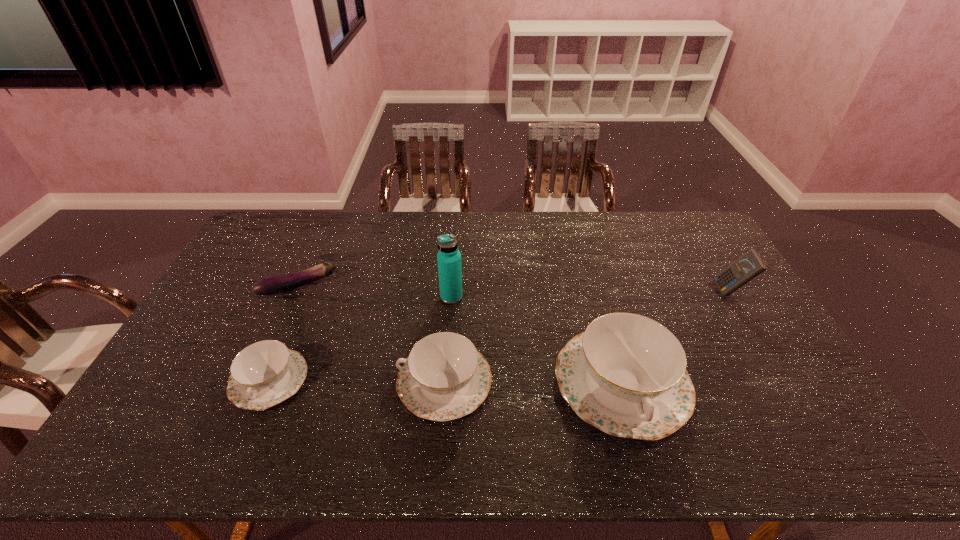
Given the evenly spaced chinawares in the image, where should an extra chinaware be added on the right to preserve the spacing? Please point to a vacant space. Please provide its 2D coordinates. Your answer should be formatted as a tuple, i.e. [(x, y)], where the tuple contains the x and y coordinates of a point satisfying the conditions above.

[(799, 385)]